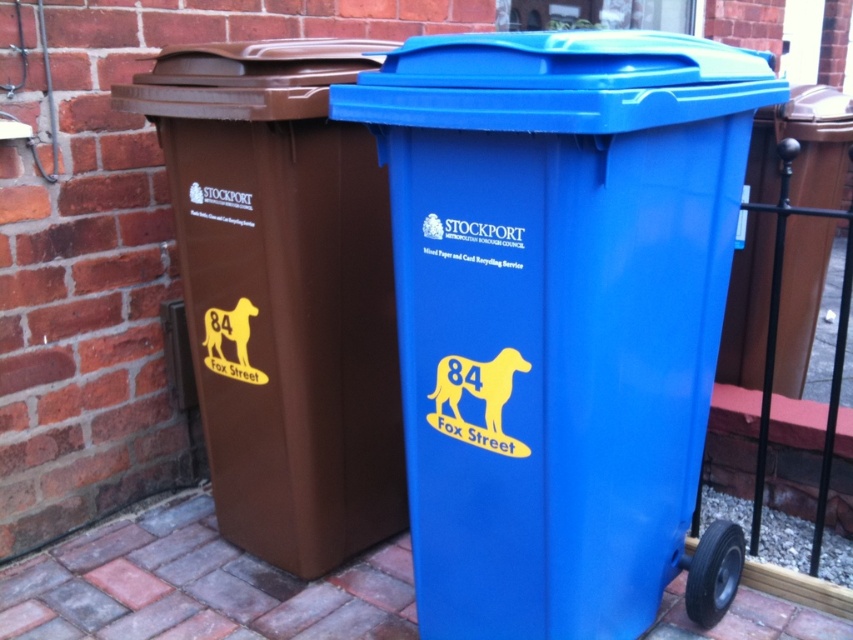
Can you confirm if blue plastic recycling bin at center is taller than brick pavement at lower left?

Yes.

Can you confirm if blue plastic recycling bin at center is shorter than brick pavement at lower left?

In fact, blue plastic recycling bin at center may be taller than brick pavement at lower left.

Is point (703, 84) positioned in front of point (346, 586)?

Yes, it is in front of point (346, 586).

The image size is (853, 640). In order to click on blue plastic recycling bin at center in this screenshot , I will do 556,310.

Does brown matte plastic recycling bin at left lie behind brick pavement at lower left?

No, brown matte plastic recycling bin at left is in front of brick pavement at lower left.

Does brown matte plastic recycling bin at left have a lesser width compared to brick pavement at lower left?

Yes.

Measure the distance between brown matte plastic recycling bin at left and camera.

A distance of 5.42 feet exists between brown matte plastic recycling bin at left and camera.

Locate an element on the screen. Image resolution: width=853 pixels, height=640 pixels. brown matte plastic recycling bin at left is located at coordinates (283, 292).

Can you confirm if brown matte plastic recycling bin at left is positioned to the left of blue plastic bin at right?

Yes, brown matte plastic recycling bin at left is to the left of blue plastic bin at right.

Between point (328, 291) and point (811, 284), which one is positioned in front?

Point (328, 291) is more forward.

Where is `brown matte plastic recycling bin at left`? The height and width of the screenshot is (640, 853). brown matte plastic recycling bin at left is located at coordinates (283, 292).